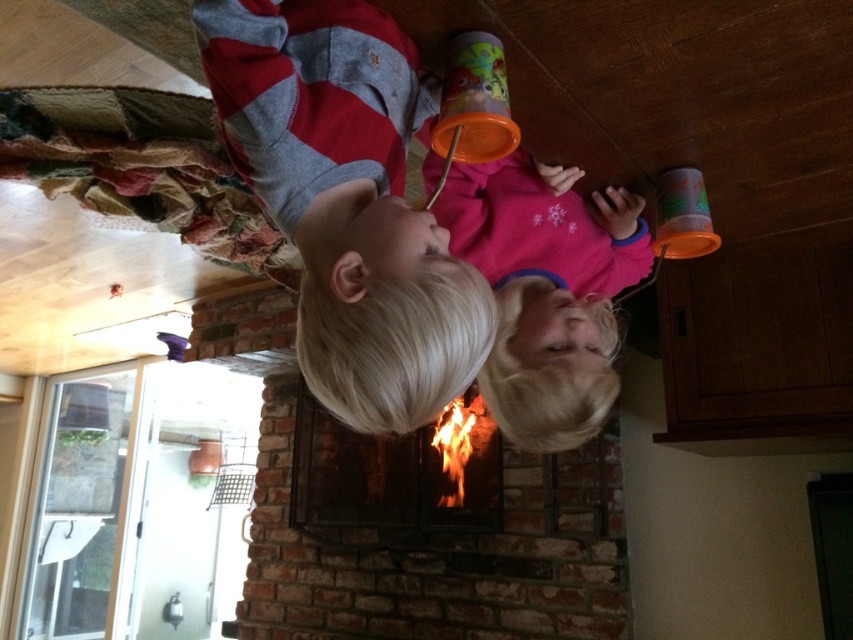
You are a photographer trying to capture the children and the fireplace in the image. The point at coordinate point (x=347, y=202) marks the center of the matte gray sweater. If you want to focus on the matte gray sweater at center, which object should you adjust your camera to focus on?

The point at coordinate point (x=347, y=202) marks the center of the matte gray sweater at center, so you should adjust your camera to focus on the matte gray sweater at center.

You are a photographer positioned in front of the fireplace. You want to take a closeup shot of the matte gray sweater at center without including the children or any other objects in the frame. Based on the scene description, what is the minimum distance you need to move forward to achieve this?

The minimum distance you need to move forward is 68.92 centimeters to get a closeup of the matte gray sweater at center without including other objects, as it is currently 68.92 centimeters away from the camera.

You are a parent trying to decide which item to place a small decoration on. The decoration is 10 cm tall. You have the pink fleece sweater at center and the brick fireplace at center. Based on their heights, which item can the decoration be placed on without falling off?

The decoration can be placed on the brick fireplace at center because it is taller than the pink fleece sweater at center, providing a stable surface for the decoration.